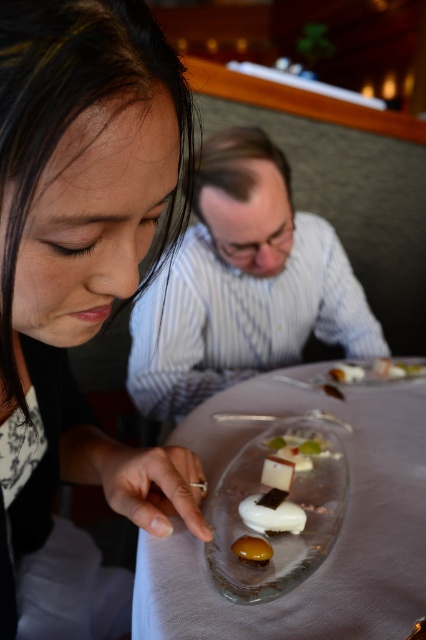
You are a waiter at a fine dining restaurant and need to place a new dish on the table. The existing setup has the clear glass plate at center. Where should you place the new dish so it doesn not obstruct the point at coordinates point (339, 534)?

The point (339, 534) is on the clear glass plate at center, so you should place the new dish away from the clear glass plate at center to avoid blocking that point.

You are a photographer taking a portrait of the two people at the dining table. The matte black hair at upper left and the white striped shirt at upper center are both in the frame. Which object is positioned higher in the image?

The matte black hair at upper left is taller than the white striped shirt at upper center, so the matte black hair at upper left is positioned higher in the image.